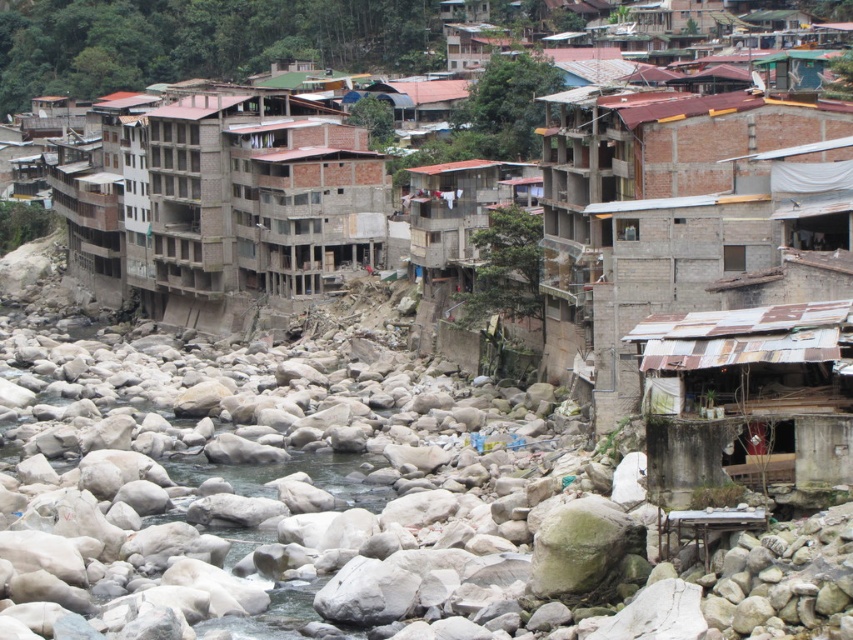
Question: Which object is positioned farthest from the rusty corrugated metal hut at lower right?

Choices:
 (A) brown concrete building at center
 (B) brown brick buildings at center

Answer: (A)

Question: Which is nearer to the brown brick buildings at center?

Choices:
 (A) rusty corrugated metal hut at lower right
 (B) brown concrete building at center

Answer: (B)

Question: Where is brown brick buildings at center located in relation to rusty corrugated metal hut at lower right in the image?

Choices:
 (A) below
 (B) above

Answer: (B)

Question: Is brown brick buildings at center to the left of rusty corrugated metal hut at lower right from the viewer's perspective?

Choices:
 (A) yes
 (B) no

Answer: (A)

Question: Which object is closer to the camera taking this photo?

Choices:
 (A) brown brick buildings at center
 (B) brown concrete building at center

Answer: (A)

Question: Is brown brick buildings at center wider than brown concrete building at center?

Choices:
 (A) yes
 (B) no

Answer: (A)